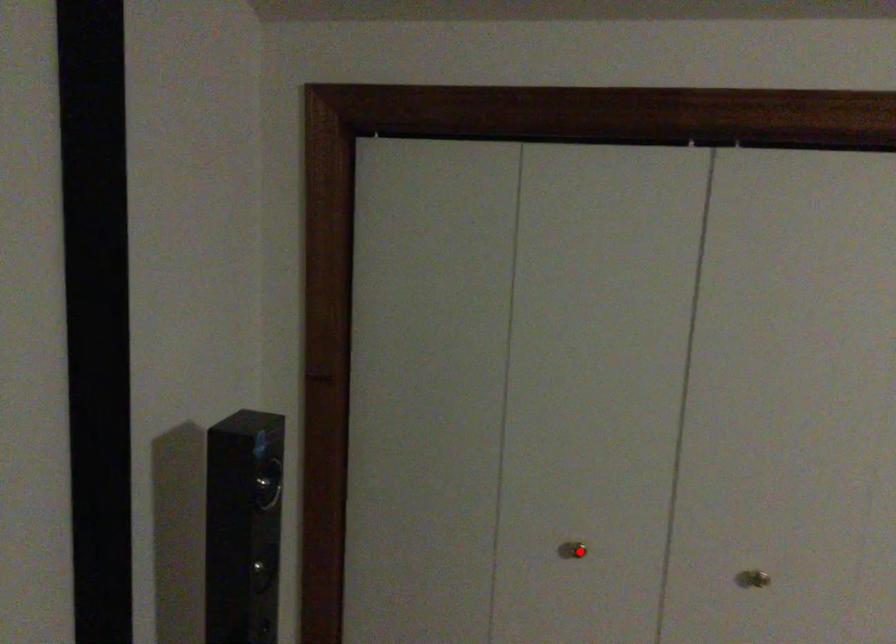
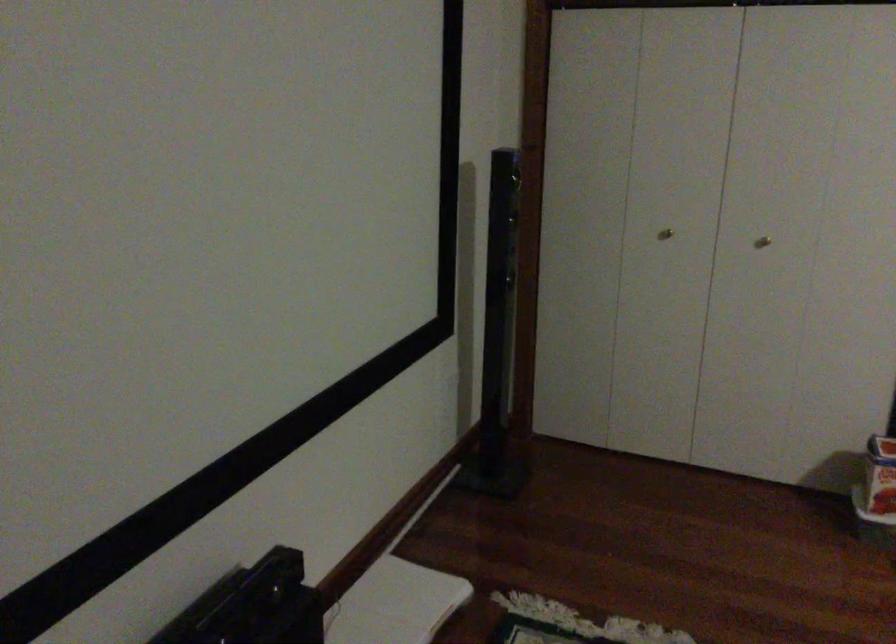
Locate, in the second image, the point that corresponds to the highlighted location in the first image.

(665, 234)